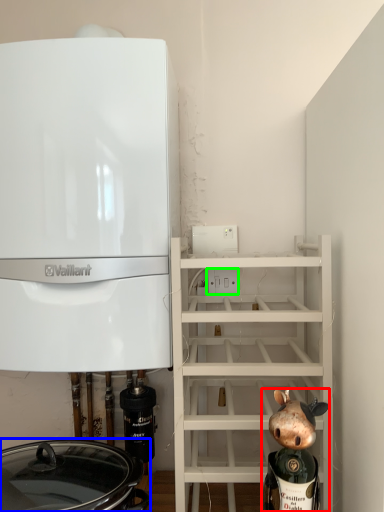
Question: Based on their relative distances, which object is nearer to figurine (highlighted by a red box)? Choose from crock pot (highlighted by a blue box) and electric outlet (highlighted by a green box).

Choices:
 (A) crock pot
 (B) electric outlet

Answer: (A)